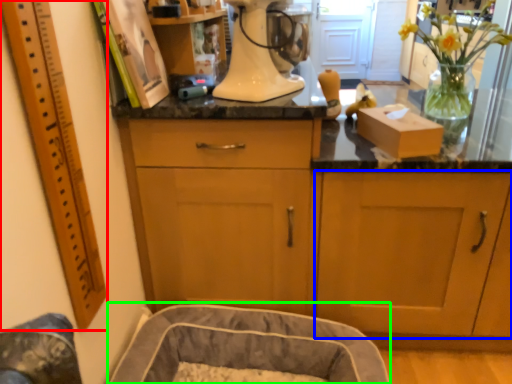
Question: Estimate the real-world distances between objects in this image. Which object is closer to ruler (highlighted by a red box), cabinetry (highlighted by a blue box) or dog bed (highlighted by a green box)?

Choices:
 (A) cabinetry
 (B) dog bed

Answer: (B)